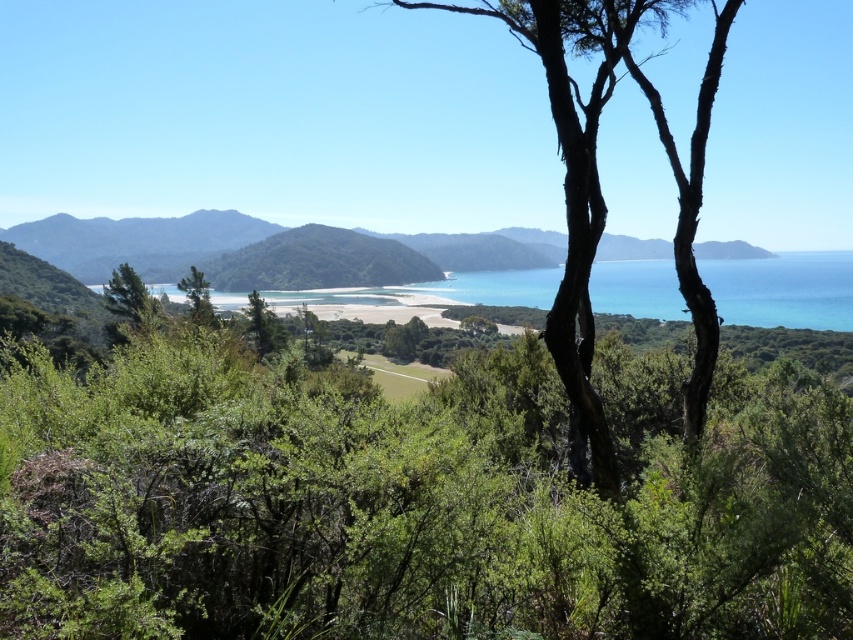
Does smooth bark tree at center come in front of green grassy mountain at center?

Yes, it is in front of green grassy mountain at center.

The image size is (853, 640). Describe the element at coordinates (602, 196) in the screenshot. I see `smooth bark tree at center` at that location.

Image resolution: width=853 pixels, height=640 pixels. What are the coordinates of `smooth bark tree at center` in the screenshot? It's located at (602, 196).

Does green grassy mountain at center appear under turquoise glossy water at center?

No.

Is green grassy mountain at center taller than turquoise glossy water at center?

Indeed, green grassy mountain at center has a greater height compared to turquoise glossy water at center.

Consider the image. Who is more forward, (248, 234) or (705, 268)?

Point (705, 268) is more forward.

Find the location of a particular element. green grassy mountain at center is located at coordinates (138, 241).

Is point (45, 376) positioned in front of point (194, 314)?

Yes, it is.

Does point (175, 634) lie in front of point (178, 284)?

Yes, point (175, 634) is closer to viewer.

Identify the location of green leafy tree at center. The image size is (853, 640). (413, 500).